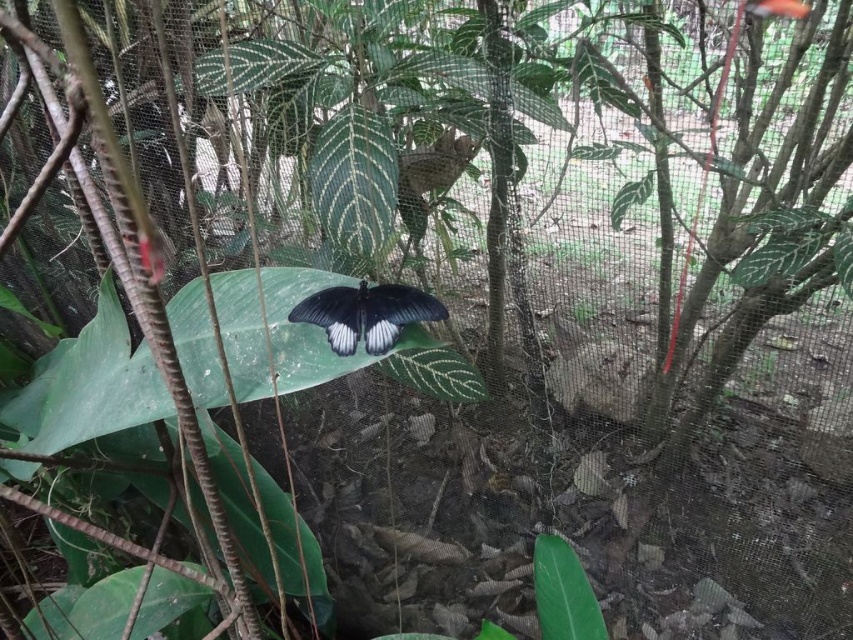
Measure the distance between black glossy butterfly at center and green glossy leaf at upper center.

28.43 inches

Who is lower down, black glossy butterfly at center or green glossy leaf at upper center?

black glossy butterfly at center

Who is more forward, (334, 349) or (247, 60)?

Point (334, 349) is more forward.

This screenshot has width=853, height=640. What are the coordinates of `black glossy butterfly at center` in the screenshot? It's located at (x=366, y=314).

Does point (341, 161) come closer to viewer compared to point (540, 545)?

Yes, it is.

Locate an element on the screen. The image size is (853, 640). green textured leaf at center is located at coordinates (354, 180).

Which is below, green textured leaf at center or green glossy leaf at upper center?

Positioned lower is green textured leaf at center.

Between green textured leaf at center and green glossy leaf at upper center, which one appears on the left side from the viewer's perspective?

Positioned to the left is green glossy leaf at upper center.

The image size is (853, 640). What do you see at coordinates (354, 180) in the screenshot? I see `green textured leaf at center` at bounding box center [354, 180].

Find the location of a particular element. green textured leaf at center is located at coordinates (354, 180).